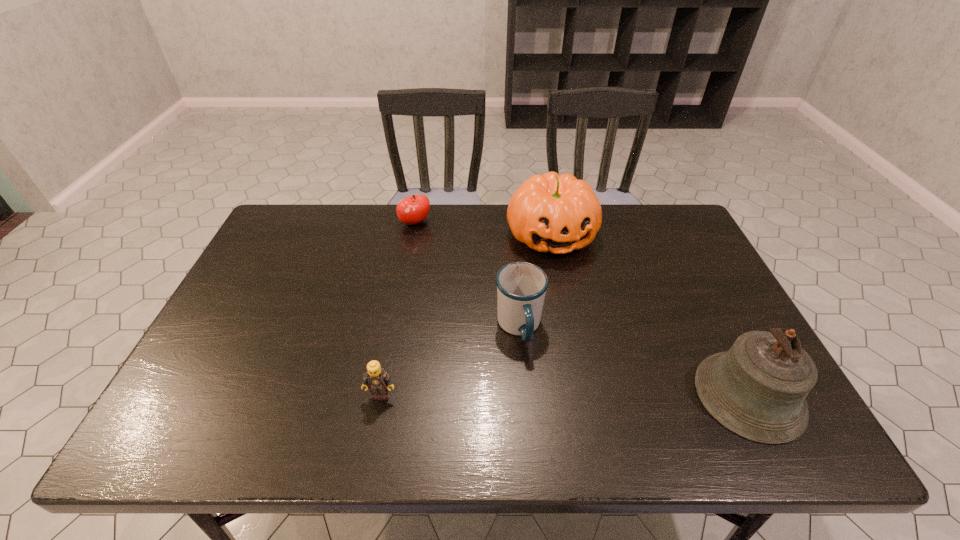
Locate an element on the screen. The height and width of the screenshot is (540, 960). Lego is located at coordinates (378, 381).

Locate an element on the screen. The height and width of the screenshot is (540, 960). bell is located at coordinates (757, 389).

This screenshot has height=540, width=960. In order to click on apple in this screenshot , I will do `click(411, 210)`.

Image resolution: width=960 pixels, height=540 pixels. What are the coordinates of `pumpkin` in the screenshot? It's located at (554, 213).

Locate an element on the screen. The height and width of the screenshot is (540, 960). the third shortest object is located at coordinates (521, 286).

This screenshot has height=540, width=960. I want to click on free space located on the back of the rightmost object, so click(x=710, y=320).

The height and width of the screenshot is (540, 960). I want to click on free space located 0.340m on the stem of the apple, so pyautogui.click(x=466, y=296).

The image size is (960, 540). In order to click on blank space located 0.160m on the stem of the apple in this screenshot , I will do [441, 259].

Find the location of a particular element. This screenshot has height=540, width=960. free space located on the stem of the apple is located at coordinates [x=431, y=246].

Where is `free point located 0.380m on the carved face of the pumpkin`? free point located 0.380m on the carved face of the pumpkin is located at coordinates (601, 368).